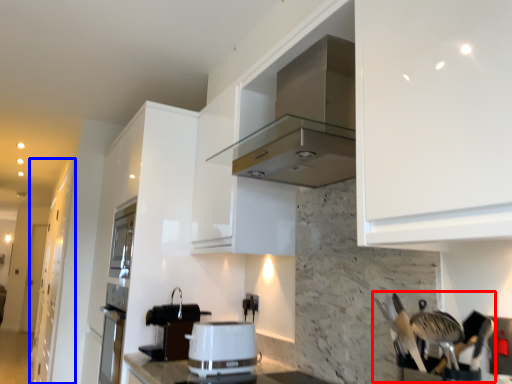
Question: Which object appears closest to the camera in this image, silverware (highlighted by a red box) or cabinetry (highlighted by a blue box)?

Choices:
 (A) silverware
 (B) cabinetry

Answer: (A)